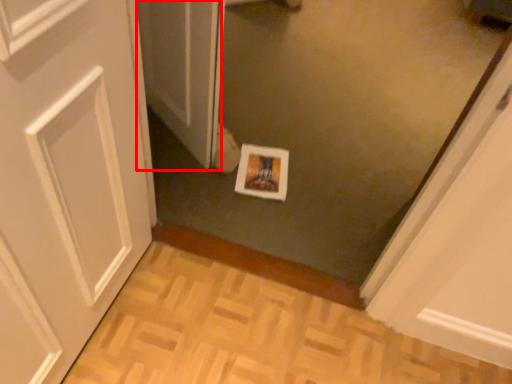
Question: From the image, what is the correct spatial relationship of screen door (annotated by the red box) in relation to print?

Choices:
 (A) left
 (B) right

Answer: (A)